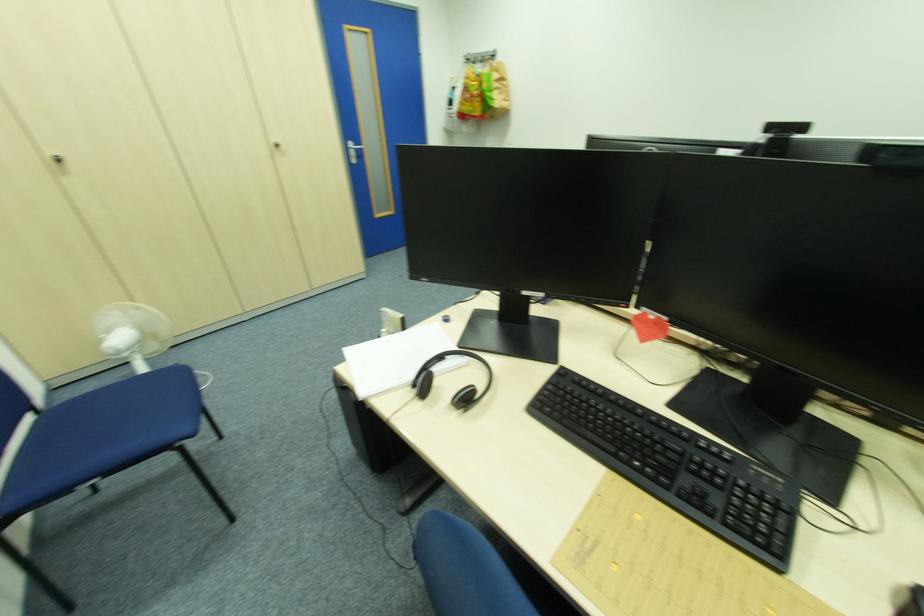
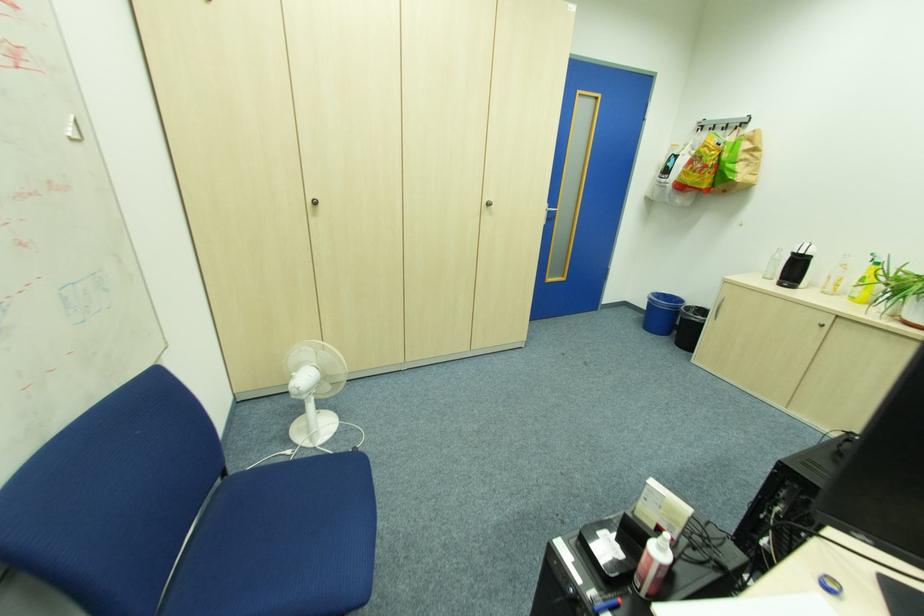
The images are taken continuously from a first-person perspective. In which direction are you moving?

The cameraman walked toward left, forward.